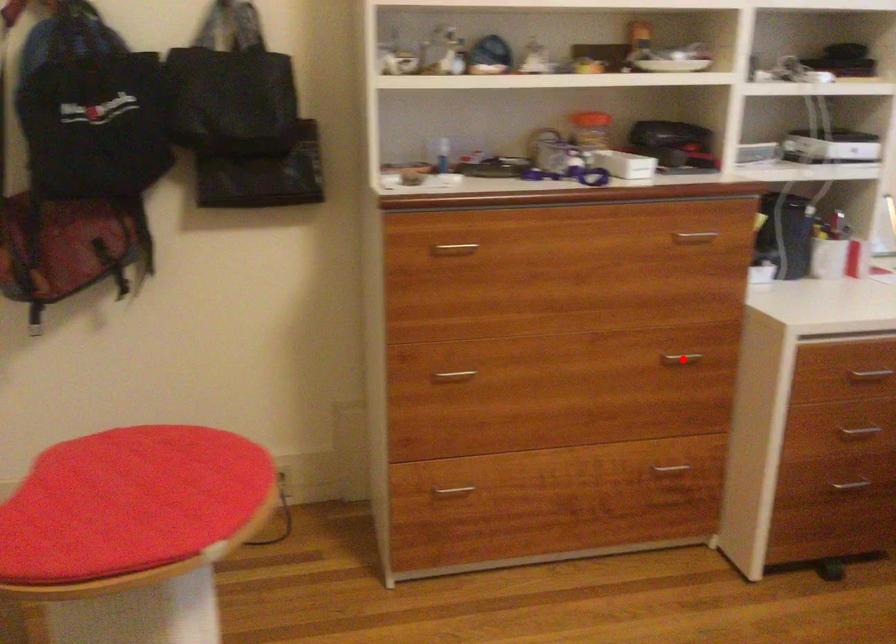
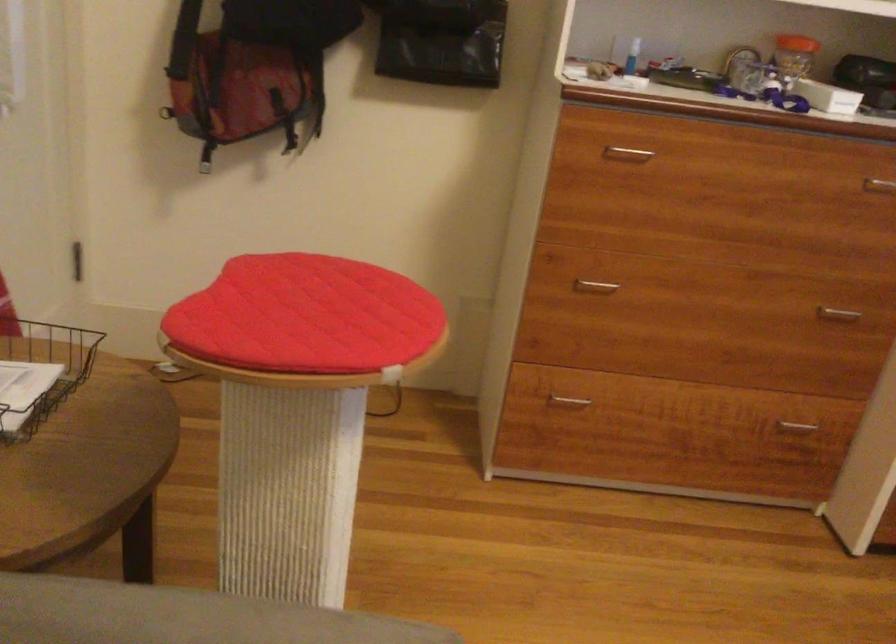
Where in the second image is the point corresponding to the highlighted location from the first image?

(837, 313)